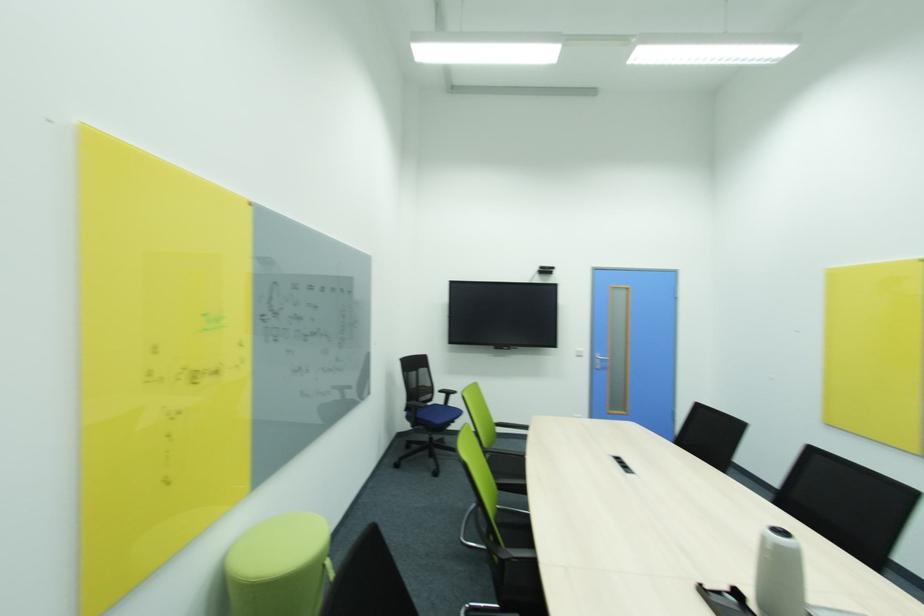
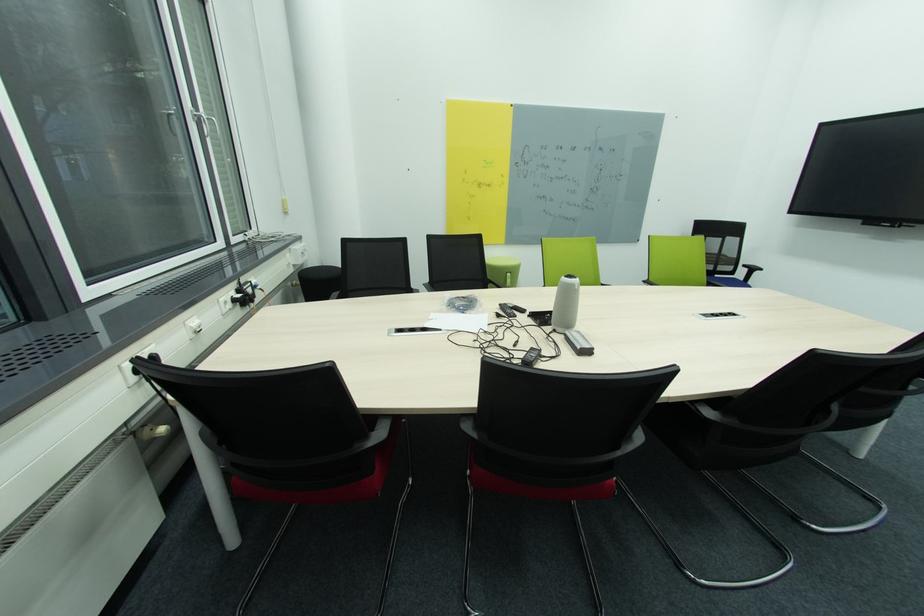
In the second image, find the point that corresponds to [444,392] in the first image.

(749, 267)